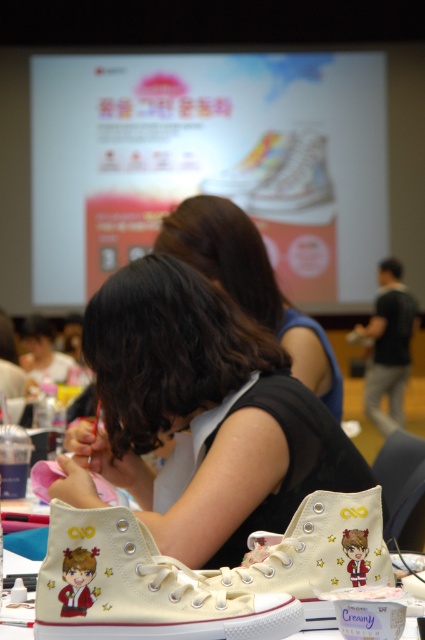
Question: Which point appears farthest from the camera in this image?

Choices:
 (A) (252, 184)
 (B) (291, 138)

Answer: (B)

Question: Is white canvas shoe at lower center further to the viewer compared to matte black hair at center?

Choices:
 (A) yes
 (B) no

Answer: (B)

Question: Considering the real-world distances, which object is closest to the beige canvas shoes at lower center?

Choices:
 (A) matte white sneakers at lower center
 (B) matte black hair at center

Answer: (A)

Question: Which point is farther to the camera?

Choices:
 (A) white matte shoe at center
 (B) white matte high-top shoe at upper center
 (C) matte black hair at center
 (D) beige canvas shoes at lower center

Answer: (B)

Question: Is matte white sneakers at lower center closer to camera compared to white canvas shoe at center?

Choices:
 (A) no
 (B) yes

Answer: (A)

Question: Does white canvas shoe at lower center appear over white matte shoe at center?

Choices:
 (A) no
 (B) yes

Answer: (A)